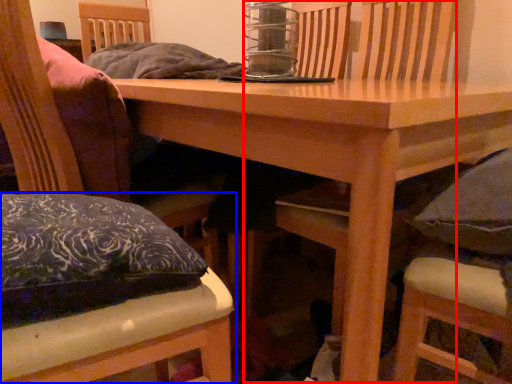
Question: Which object appears closest to the camera in this image, armchair (highlighted by a red box) or chair (highlighted by a blue box)?

Choices:
 (A) armchair
 (B) chair

Answer: (B)